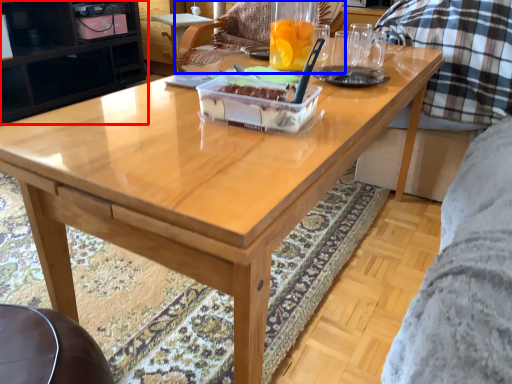
Question: Which point is closer to the camera, cabinetry (highlighted by a red box) or chair (highlighted by a blue box)?

Choices:
 (A) cabinetry
 (B) chair

Answer: (B)